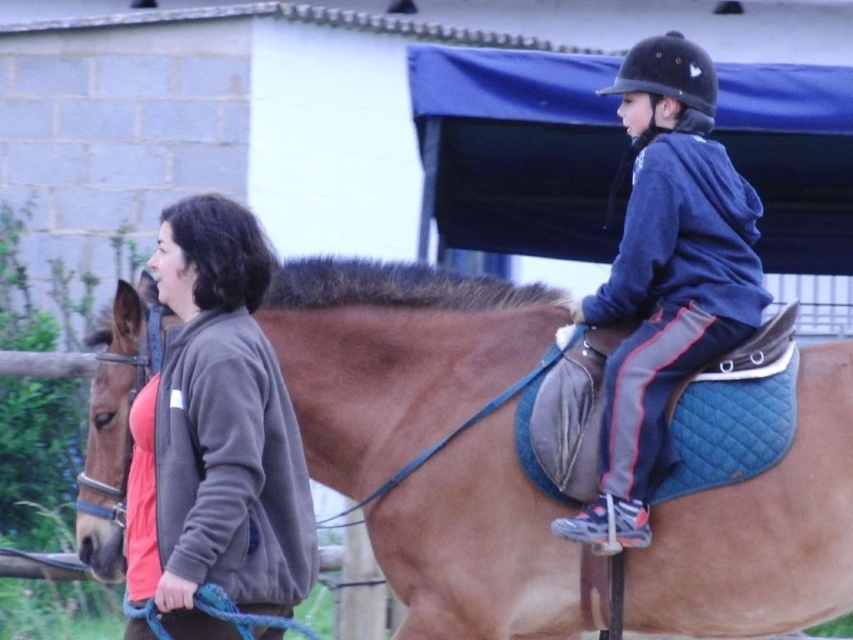
Is brown leather saddle at upper right smaller than brown fleece jacket at left?

No, brown leather saddle at upper right is not smaller than brown fleece jacket at left.

Does brown leather saddle at upper right appear on the left side of brown fleece jacket at left?

No, brown leather saddle at upper right is not to the left of brown fleece jacket at left.

Does point (506, 436) come farther from viewer compared to point (213, 298)?

Yes, it is behind point (213, 298).

Where is `brown leather saddle at upper right`? This screenshot has width=853, height=640. brown leather saddle at upper right is located at coordinates (393, 356).

Who is positioned more to the left, brown fleece jacket at left or blue fleece jacket at upper right?

Positioned to the left is brown fleece jacket at left.

Which is in front, point (161, 237) or point (573, 522)?

Positioned in front is point (161, 237).

Where is `brown fleece jacket at left`? This screenshot has width=853, height=640. brown fleece jacket at left is located at coordinates pyautogui.click(x=215, y=436).

Is brown leather saddle at upper right wider than blue fleece jacket at upper right?

Indeed, brown leather saddle at upper right has a greater width compared to blue fleece jacket at upper right.

Is brown leather saddle at upper right below blue fleece jacket at upper right?

Indeed, brown leather saddle at upper right is positioned under blue fleece jacket at upper right.

The image size is (853, 640). In order to click on brown leather saddle at upper right in this screenshot , I will do `click(393, 356)`.